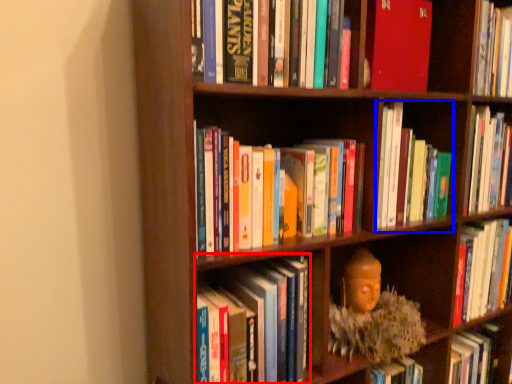
Question: Which of the following is the closest to the observer, book (highlighted by a red box) or book (highlighted by a blue box)?

Choices:
 (A) book
 (B) book

Answer: (A)